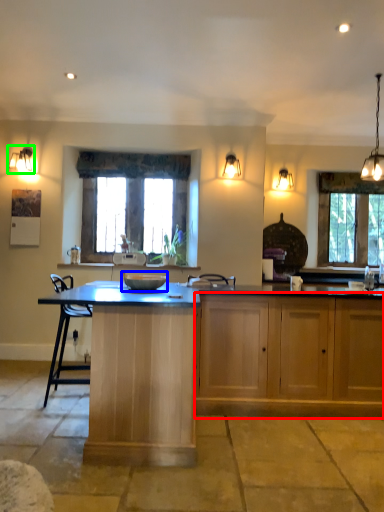
Question: Considering the real-world distances, which object is closest to cabinetry (highlighted by a red box)? bowl (highlighted by a blue box) or lamp (highlighted by a green box).

Choices:
 (A) bowl
 (B) lamp

Answer: (A)